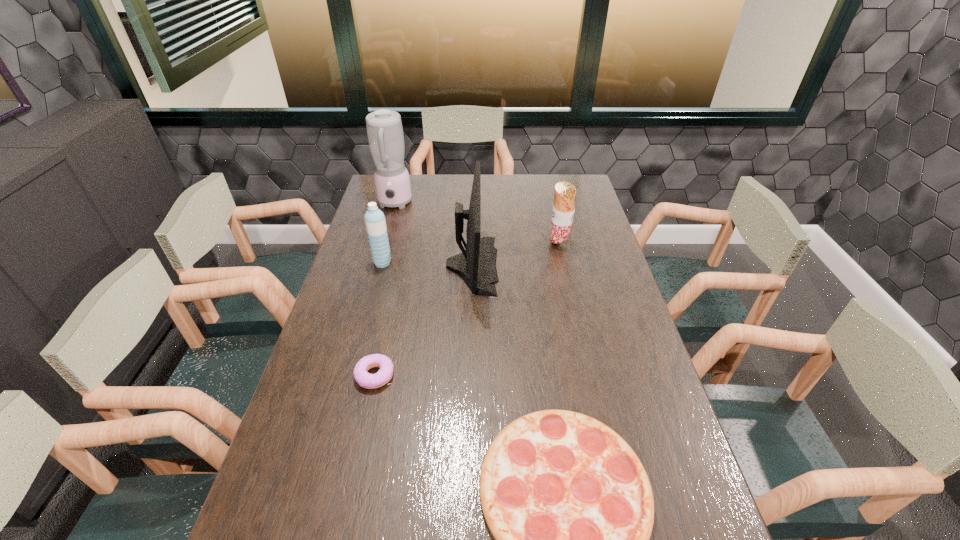
You are a GUI agent. You are given a task and a screenshot of the screen. Output one action in this format:
    pyautogui.click(x=<x>, y=<y>)
    Task: Click on the vacant position in the image that satisfies the following two spatial constraints: 1. on the screen side of the monitor; 2. on the front side of the fifth farthest object
    The width and height of the screenshot is (960, 540).
    Given the screenshot: What is the action you would take?
    pyautogui.click(x=469, y=375)

Where is `vacant space that satisfies the following two spatial constraints: 1. on the base of the tallest object near the control knob; 2. on the left side of the fifth farthest object`? The height and width of the screenshot is (540, 960). vacant space that satisfies the following two spatial constraints: 1. on the base of the tallest object near the control knob; 2. on the left side of the fifth farthest object is located at coordinates tap(347, 375).

The image size is (960, 540). I want to click on vacant area that satisfies the following two spatial constraints: 1. on the base of the water bottle near the control knob; 2. on the right side of the farthest object, so (378, 262).

Find the location of a particular element. This screenshot has width=960, height=540. vacant region that satisfies the following two spatial constraints: 1. on the base of the food processor near the control knob; 2. on the right side of the burrito is located at coordinates (383, 244).